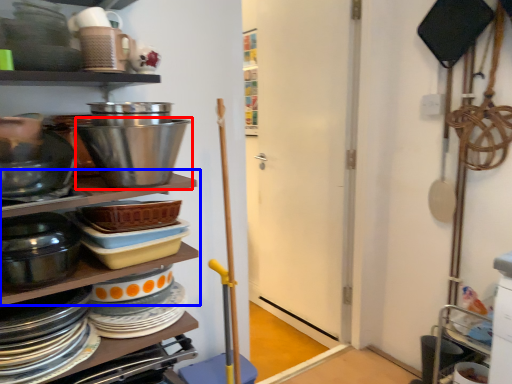
Question: Which of the following is the farthest to the observer, bowl (highlighted by a red box) or shelf (highlighted by a blue box)?

Choices:
 (A) bowl
 (B) shelf

Answer: (A)